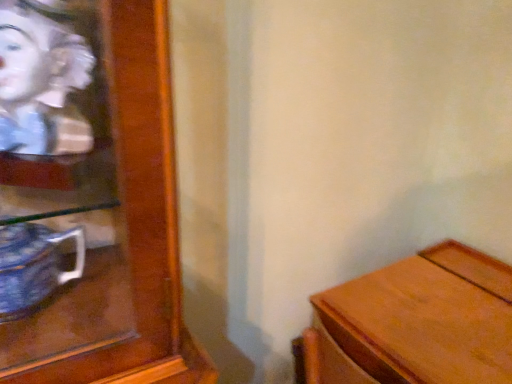
Measure the distance between point (396, 288) and camera.

Point (396, 288) and camera are 38.31 inches apart.

This screenshot has height=384, width=512. What do you see at coordinates (414, 323) in the screenshot?
I see `wooden table at lower right` at bounding box center [414, 323].

What are the coordinates of `wooden table at lower right` in the screenshot? It's located at (414, 323).

This screenshot has width=512, height=384. What are the coordinates of `wooden table at lower right` in the screenshot? It's located at (414, 323).